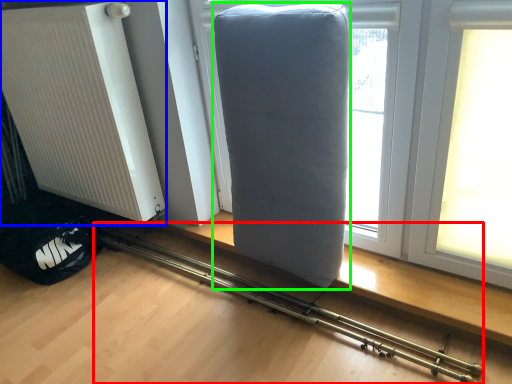
Question: Considering the real-world distances, which object is farthest from equipment (highlighted by a red box)? radiator (highlighted by a blue box) or furniture (highlighted by a green box)?

Choices:
 (A) radiator
 (B) furniture

Answer: (A)